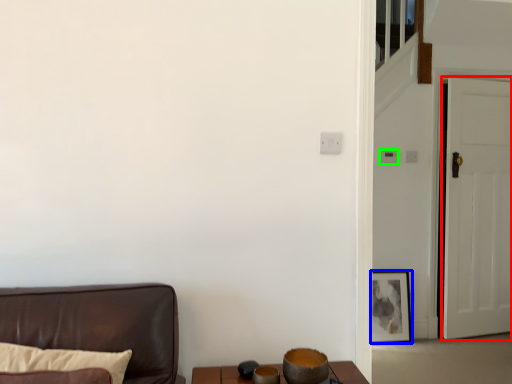
Question: Considering the real-world distances, which object is closest to door (highlighted by a red box)? picture frame (highlighted by a blue box) or light switch (highlighted by a green box).

Choices:
 (A) picture frame
 (B) light switch

Answer: (A)